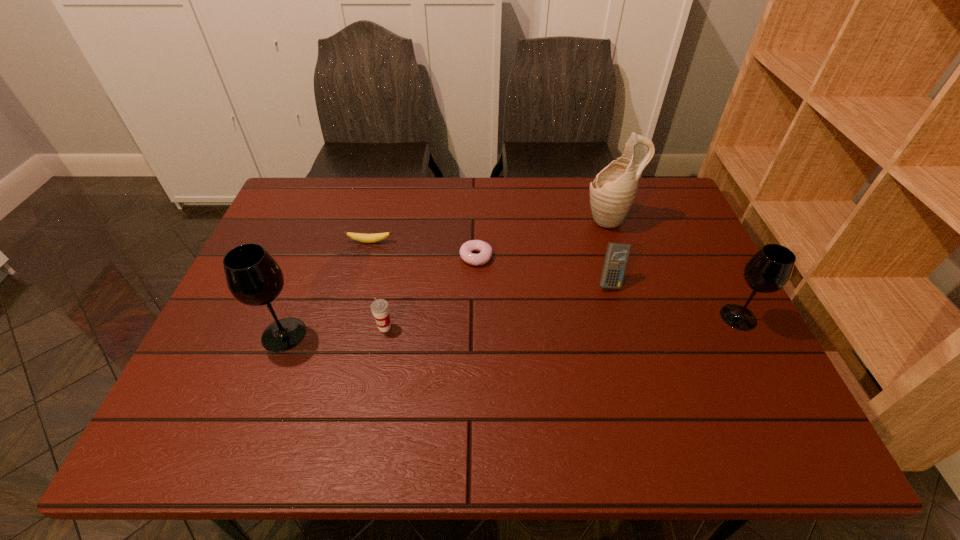
The height and width of the screenshot is (540, 960). Identify the location of vacant space positioned 0.370m on the right of the leftmost object. (461, 334).

Identify the location of vacant position located 0.400m on the left of the right wineglass. (559, 317).

Where is `free location located on the front of the sixth nearest object`? The width and height of the screenshot is (960, 540). free location located on the front of the sixth nearest object is located at coordinates [360, 280].

The width and height of the screenshot is (960, 540). I want to click on vacant space located 0.170m on the front-facing side of the fourth farthest object, so click(x=628, y=346).

This screenshot has width=960, height=540. Find the location of `vacant space situated at the spout of the pitcher`. vacant space situated at the spout of the pitcher is located at coordinates (541, 219).

Where is `vacant space located 0.140m at the spout of the pitcher`? vacant space located 0.140m at the spout of the pitcher is located at coordinates (x=538, y=219).

The height and width of the screenshot is (540, 960). What are the coordinates of `free space located 0.310m at the spout of the pitcher` in the screenshot? It's located at (483, 219).

Find the location of a particular element. vacant position located on the side of the cup with the logo is located at coordinates (373, 387).

The height and width of the screenshot is (540, 960). In order to click on vacant space located on the front of the fourth object from left to right in this screenshot , I will do `click(475, 398)`.

Find the location of a particular element. object that is positioned at the far edge is located at coordinates (612, 193).